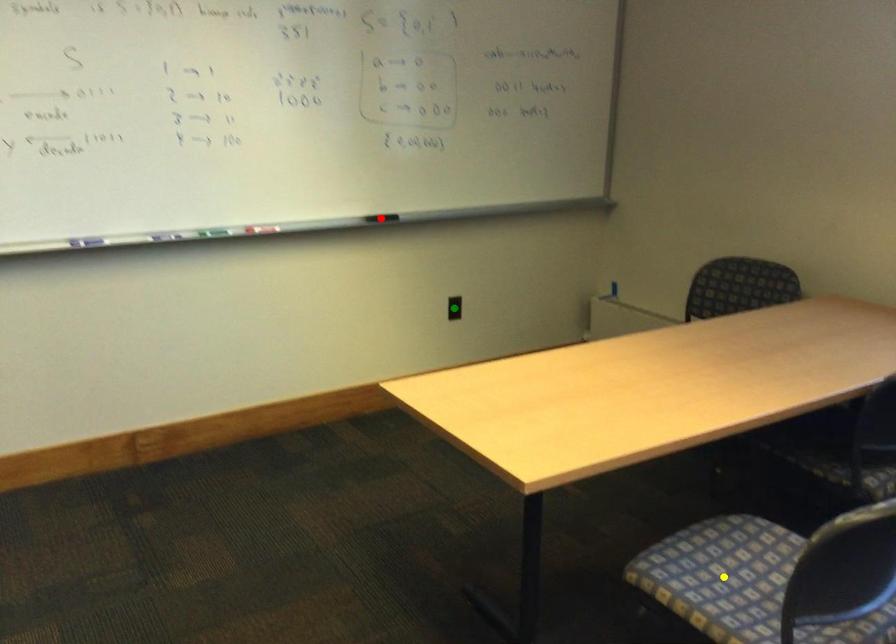
Order these from farthest to nearest:
green point | red point | yellow point

1. green point
2. red point
3. yellow point